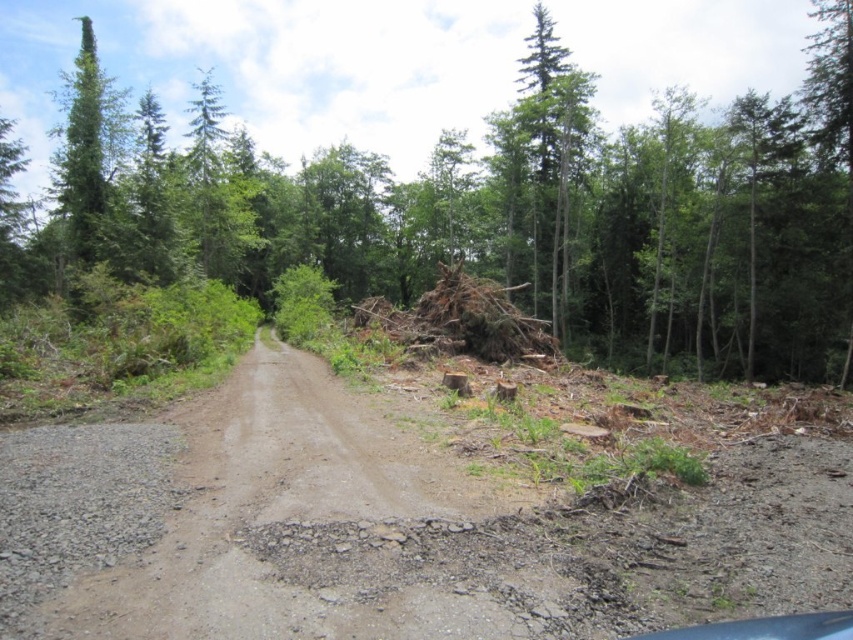
Question: Is brown dirt track at center bigger than brown wood pile at center?

Choices:
 (A) yes
 (B) no

Answer: (B)

Question: Which point is closer to the camera?

Choices:
 (A) (422, 611)
 (B) (631, 205)

Answer: (A)

Question: Is brown dirt track at center bigger than brown wood pile at center?

Choices:
 (A) yes
 (B) no

Answer: (B)

Question: Which point is closer to the camera taking this photo?

Choices:
 (A) (422, 493)
 (B) (299, 241)

Answer: (A)

Question: Which of the following is the closest to the observer?

Choices:
 (A) (498, 228)
 (B) (561, 524)

Answer: (B)

Question: Can you confirm if brown dirt track at center is positioned below brown wood pile at center?

Choices:
 (A) no
 (B) yes

Answer: (B)